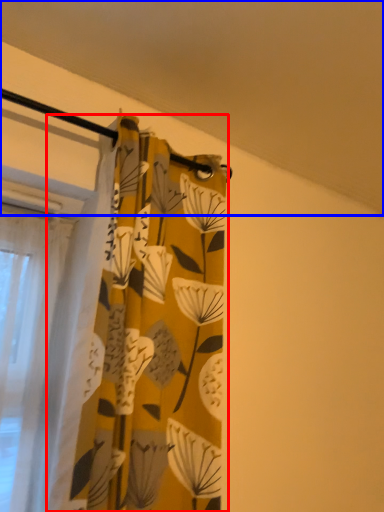
Question: Which point is further to the camera, curtain (highlighted by a red box) or backdrop (highlighted by a blue box)?

Choices:
 (A) curtain
 (B) backdrop

Answer: (A)